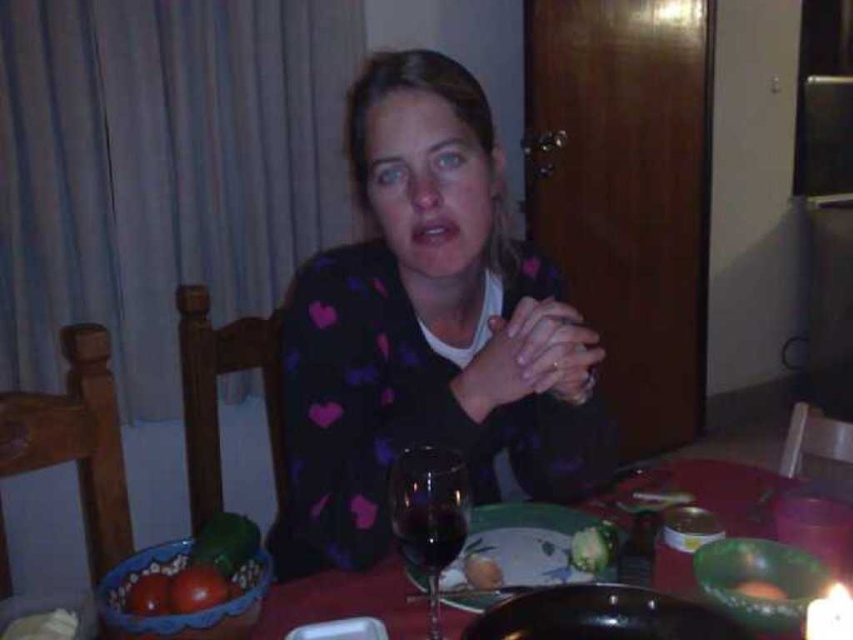
You are a waiter in a restaurant and need to place a 12 inch dessert plate on the table. The green glass bowl at lower right is in the way. Can you slide the bowl to the side to make space without moving other items? Please explain.

The green glass bowl at lower right is 30.07 inches away from the viewer. Since the dessert plate is 12 inches wide, you can slide the bowl to the side to create enough space as the distance allows movement without disturbing other items.

You are a photographer trying to capture a candid shot of the woman at the dining table. You notice two points marked on your camera screen at coordinates point (577,451) and point (466,566). To ensure the woman remains in focus, you need to determine which point is closer to the camera. Which point should you prioritize focusing on?

Point (466,566) is closer to the camera because the Objects Description states that point (577,451) is behind point (466,566).

You are a server in a restaurant and need to place a 1.5 inch wide menu between the green glass bowl at lower right and the smooth orange carrot at center. Is there enough space for the menu?

The green glass bowl at lower right is 0.85 inches from the smooth orange carrot at center, so no, the menu cannot be placed between them as the distance is less than the menu width.